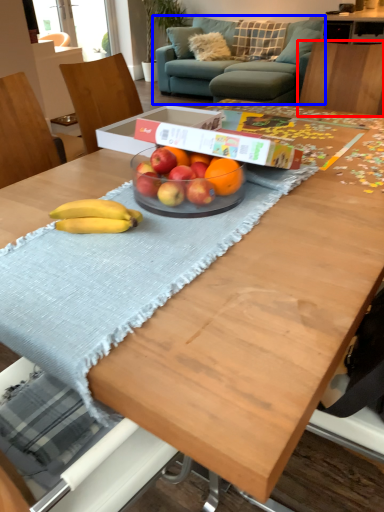
Question: Among these objects, which one is nearest to the camera, chair (highlighted by a red box) or studio couch (highlighted by a blue box)?

Choices:
 (A) chair
 (B) studio couch

Answer: (A)